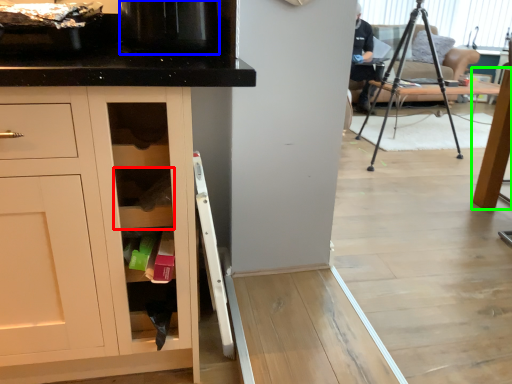
Question: Considering the real-world distances, which object is closest to shelf (highlighted by a red box)? appliance (highlighted by a blue box) or table (highlighted by a green box).

Choices:
 (A) appliance
 (B) table

Answer: (A)